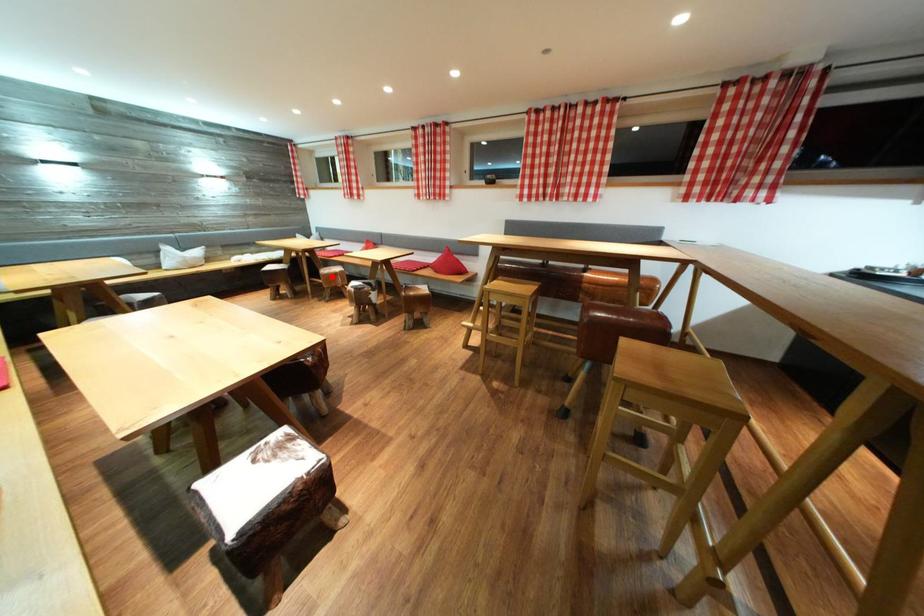
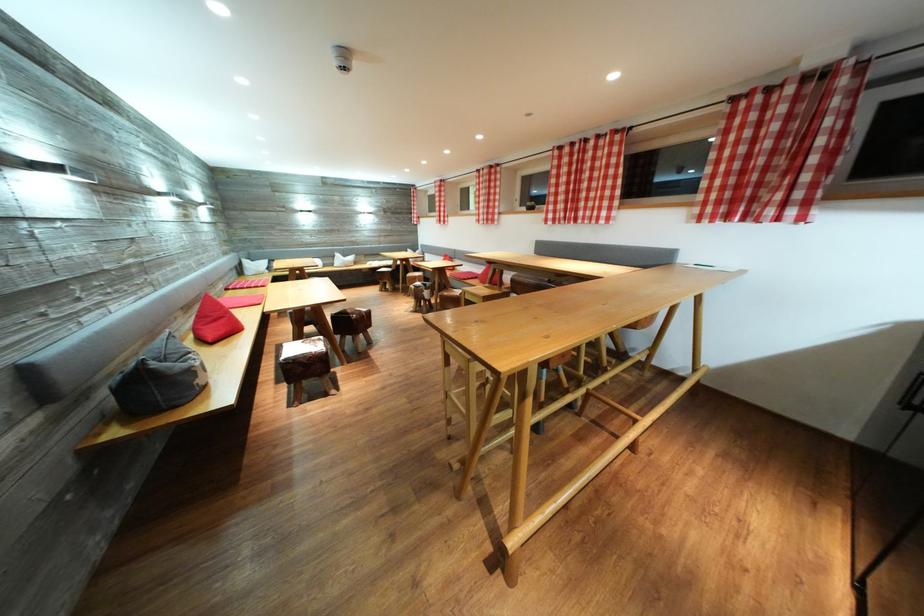
The point at the highlighted location is marked in the first image. Where is the corresponding point in the second image?

(417, 280)